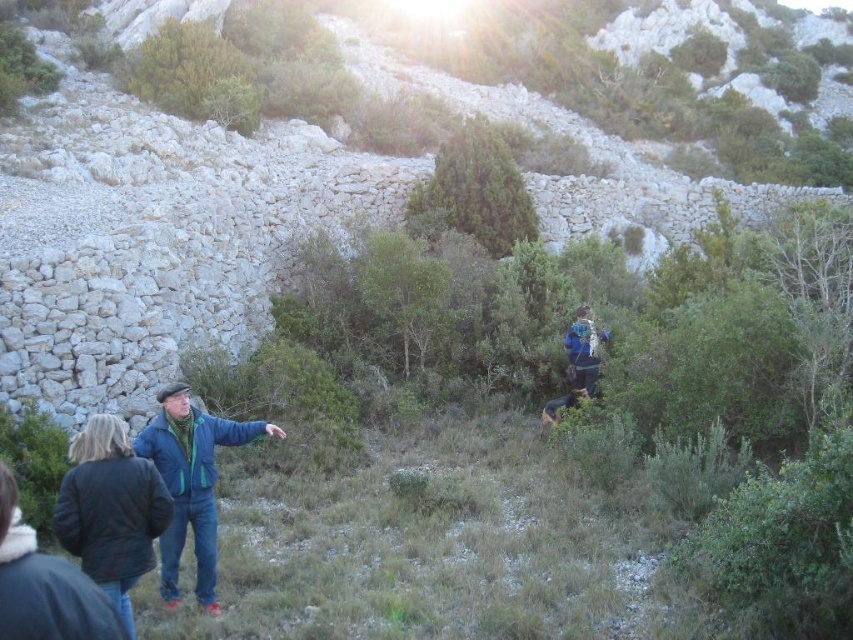
Is rough stone wall at left above blue denim jacket at lower left?

Indeed, rough stone wall at left is positioned over blue denim jacket at lower left.

Which is behind, point (115, 225) or point (154, 461)?

The point (115, 225) is more distant.

Who is more forward, (154, 248) or (137, 440)?

Point (137, 440) is more forward.

Find the location of a particular element. The image size is (853, 640). rough stone wall at left is located at coordinates (152, 237).

From the picture: Can you confirm if rough stone wall at left is positioned to the left of blue fabric backpack at center?

Yes, rough stone wall at left is to the left of blue fabric backpack at center.

Between rough stone wall at left and blue fabric backpack at center, which one has more height?

With more height is rough stone wall at left.

Is point (164, 275) farther from viewer compared to point (584, 380)?

No, it is not.

Find the location of a particular element. rough stone wall at left is located at coordinates (152, 237).

Is point (157, 253) positioned before point (106, 474)?

No, (157, 253) is further to viewer.

Can you confirm if rough stone wall at left is positioned to the left of dark blue jacket at lower left?

No, rough stone wall at left is not to the left of dark blue jacket at lower left.

Between point (231, 138) and point (161, 483), which one is positioned in front?

Point (161, 483)

At what (x,y) coordinates should I click in order to perform the action: click on rough stone wall at left. Please return your answer as a coordinate pair (x, y). This screenshot has width=853, height=640. Looking at the image, I should click on (152, 237).